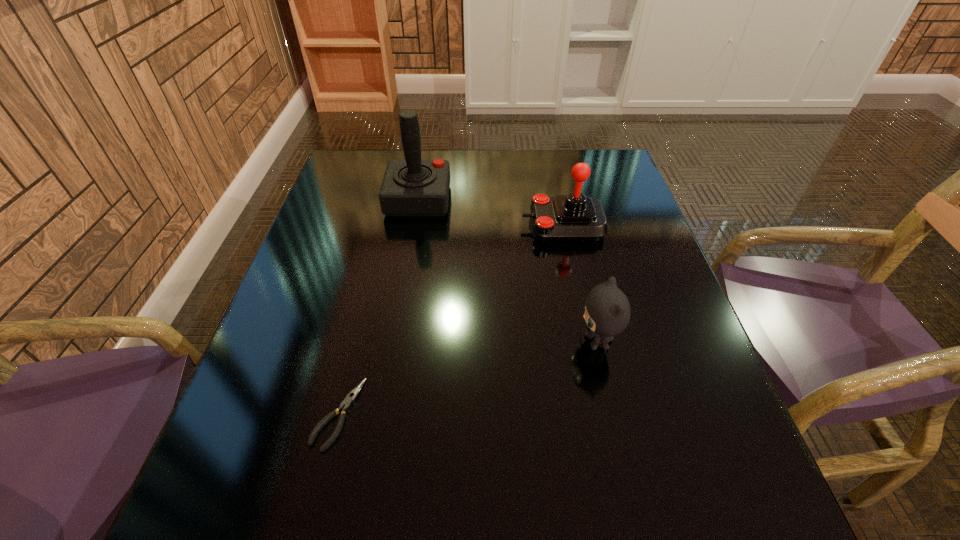
You are a GUI agent. You are given a task and a screenshot of the screen. Output one action in this format:
    pyautogui.click(x=<x>, y=<y>)
    Task: Click on the vacant space at the far edge of the desktop
    The height and width of the screenshot is (540, 960).
    Given the screenshot: What is the action you would take?
    pyautogui.click(x=485, y=156)

The width and height of the screenshot is (960, 540). What are the coordinates of `vacant space at the near edge of the desktop` in the screenshot? It's located at (452, 519).

The image size is (960, 540). In the image, there is a desktop. Identify the location of vacant space at the left edge. (309, 380).

This screenshot has width=960, height=540. I want to click on vacant space at the right edge of the desktop, so click(x=669, y=305).

Find the location of a particular element. This screenshot has width=960, height=540. vacant point at the far left corner is located at coordinates (374, 182).

Locate an element on the screen. Image resolution: width=960 pixels, height=540 pixels. free spot between the second nearest object and the tallest object is located at coordinates (508, 271).

Locate an element on the screen. vacant area that lies between the pliers and the third shortest object is located at coordinates (450, 320).

Where is `unoccupied area between the second tallest object and the shortest object`? unoccupied area between the second tallest object and the shortest object is located at coordinates (450, 320).

You are a GUI agent. You are given a task and a screenshot of the screen. Output one action in this format:
    pyautogui.click(x=<x>, y=<y>)
    Task: Click on the blank region between the shortest object and the shorter joystick
    Image resolution: width=960 pixels, height=540 pixels.
    Given the screenshot: What is the action you would take?
    pyautogui.click(x=450, y=320)

In order to click on vacant region between the shortest object and the tallest object in this screenshot , I will do `click(378, 307)`.